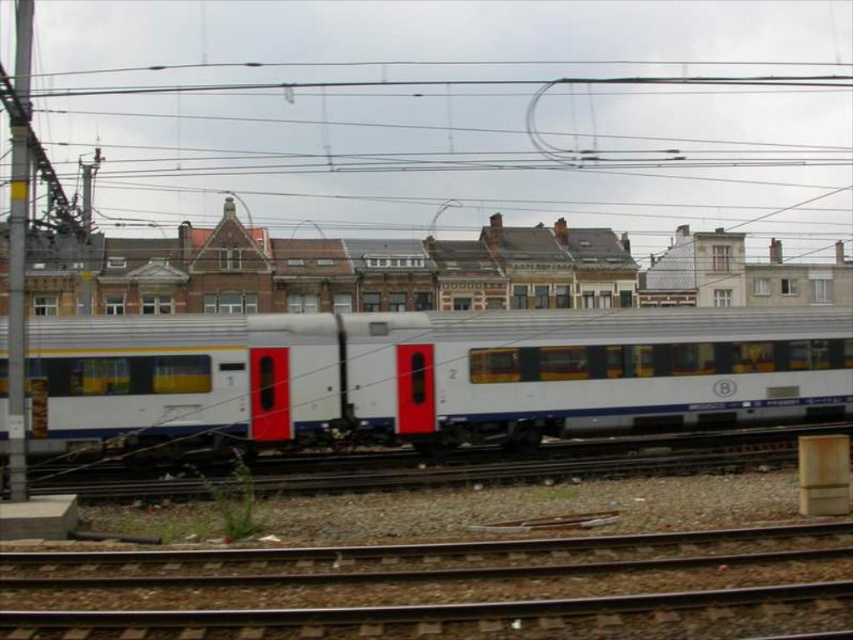
Question: Which object appears closest to the camera in this image?

Choices:
 (A) brown gravel train track at lower center
 (B) white glossy train car at center

Answer: (A)

Question: Can you confirm if white glossy train car at center is positioned to the left of brown gravel train track at lower center?

Choices:
 (A) yes
 (B) no

Answer: (B)

Question: Which of the following is the farthest from the observer?

Choices:
 (A) brown gravel train track at lower center
 (B) white glossy train car at center

Answer: (B)

Question: Can you confirm if white glossy train car at center is bigger than brown gravel train track at lower center?

Choices:
 (A) no
 (B) yes

Answer: (B)

Question: Can you confirm if white glossy train car at center is positioned to the right of brown gravel train track at lower center?

Choices:
 (A) yes
 (B) no

Answer: (A)